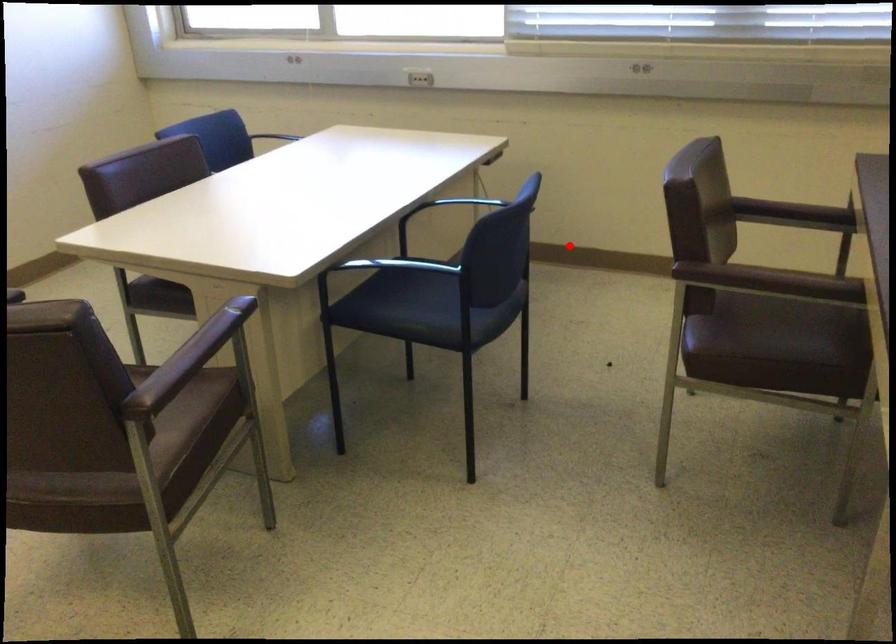
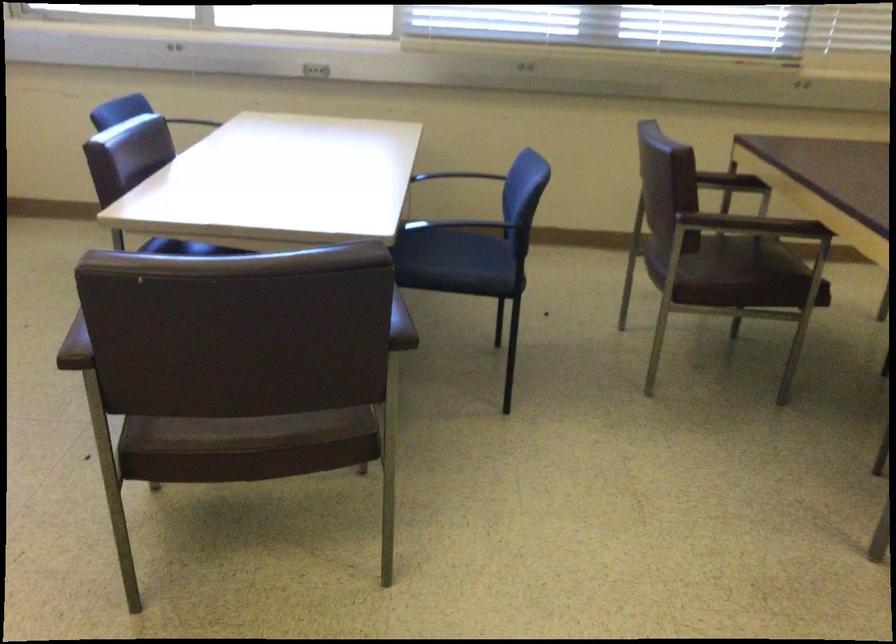
Question: I am providing you with two images of the same scene from different viewpoints. A red point is marked on the first image. At the location where the point appears in image 1, is it still visible in image 2?

Choices:
 (A) Yes
 (B) No

Answer: (A)